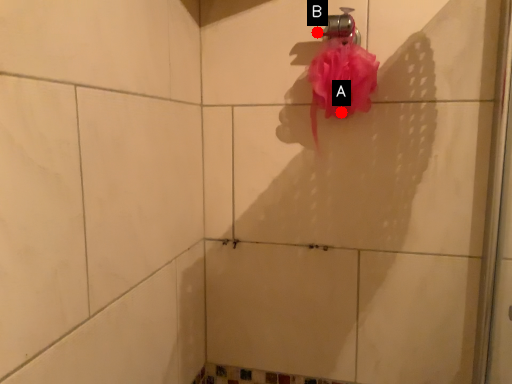
Question: Two points are circled on the image, labeled by A and B beside each circle. Which point is farther to the camera?

Choices:
 (A) A is further
 (B) B is further

Answer: (B)